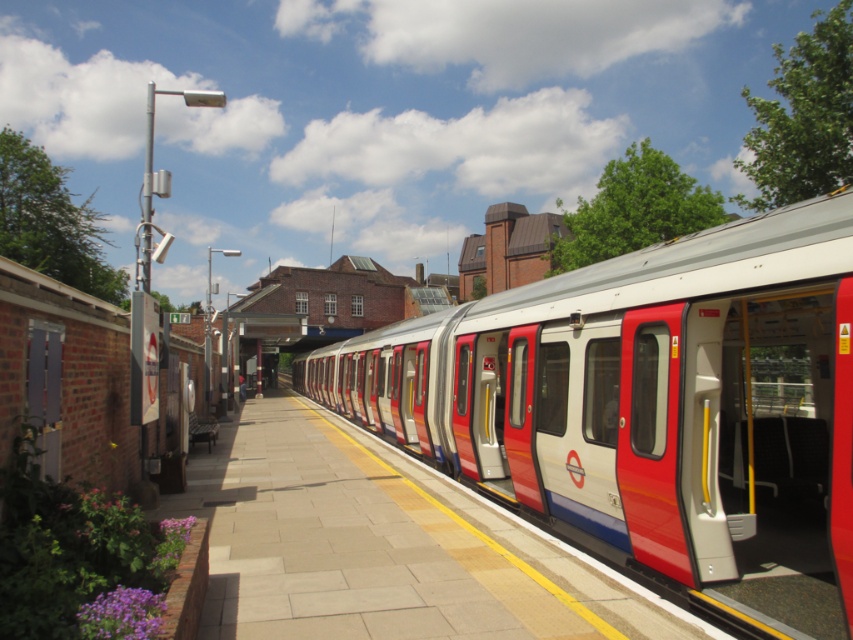
Question: Which object appears closest to the camera in this image?

Choices:
 (A) silver metallic train at center
 (B) smooth concrete platform at center

Answer: (A)

Question: Can you confirm if silver metallic train at center is thinner than smooth concrete platform at center?

Choices:
 (A) no
 (B) yes

Answer: (A)

Question: Can you confirm if silver metallic train at center is positioned below smooth concrete platform at center?

Choices:
 (A) yes
 (B) no

Answer: (B)

Question: Does silver metallic train at center have a larger size compared to smooth concrete platform at center?

Choices:
 (A) no
 (B) yes

Answer: (B)